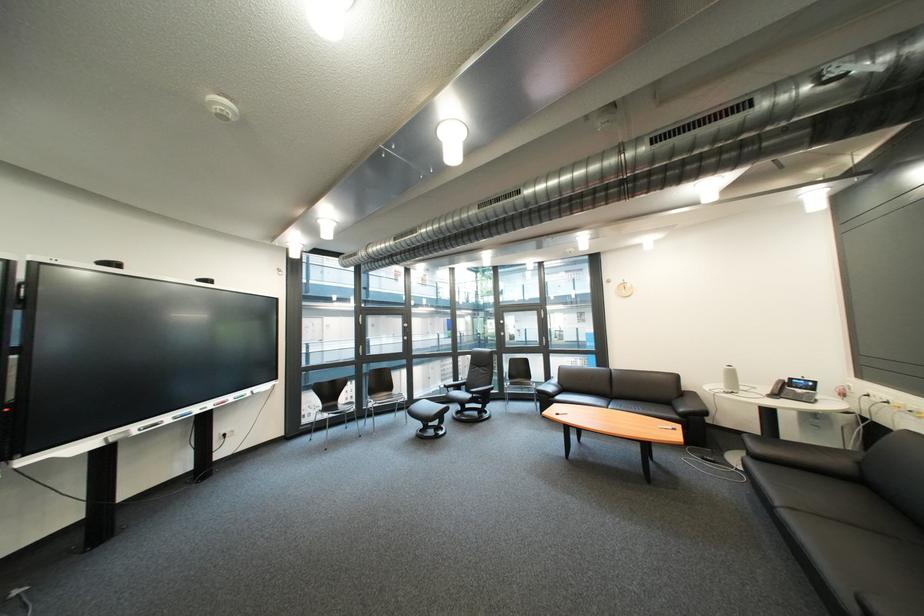
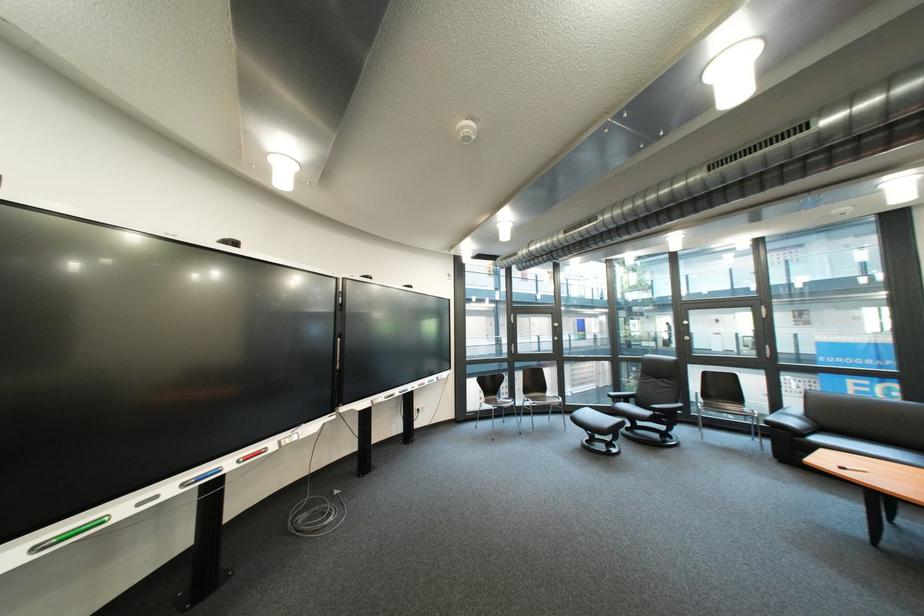
Question: The images are taken continuously from a first-person perspective. In which direction is your viewpoint rotating?

Choices:
 (A) Left
 (B) Right
 (C) Up
 (D) Down

Answer: (A)